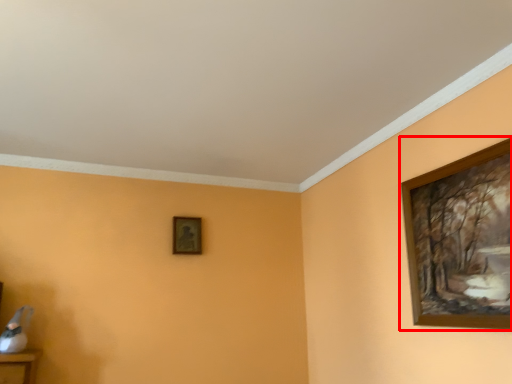
Question: Where is picture frame (annotated by the red box) located in relation to picture frame in the image?

Choices:
 (A) left
 (B) right

Answer: (B)